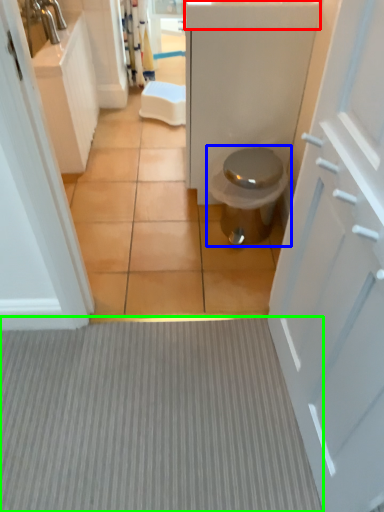
Question: Based on their relative distances, which object is farther from counter top (highlighted by a red box)? Choose from toilet (highlighted by a blue box) and plain (highlighted by a green box).

Choices:
 (A) toilet
 (B) plain

Answer: (B)